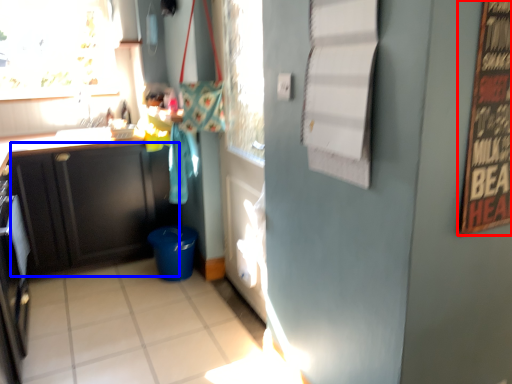
Question: Which object appears farthest to the camera in this image, bulletin board (highlighted by a red box) or cabinetry (highlighted by a blue box)?

Choices:
 (A) bulletin board
 (B) cabinetry

Answer: (B)